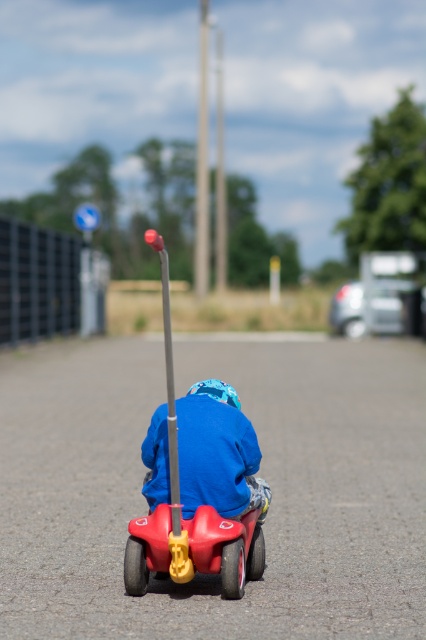
How far apart are rubberized plastic toy car at center and blue matte jacket at center?

They are 11.82 feet apart.

Can you confirm if rubberized plastic toy car at center is bigger than blue matte jacket at center?

Correct, rubberized plastic toy car at center is larger in size than blue matte jacket at center.

Is point (222, 538) more distant than point (193, 508)?

No, (222, 538) is in front of (193, 508).

Find the location of a particular element. rubberized plastic toy car at center is located at coordinates (198, 483).